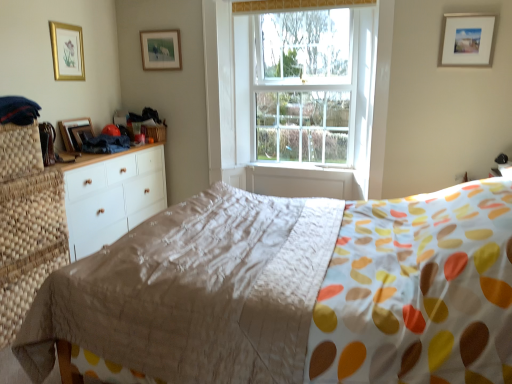
Measure the distance between white wood chest of drawers at left and camera.

8.90 feet.

What is the approximate height of white matte picture frame at upper right, placed as the fourth picture frame when sorted from left to right?

It is 14.69 inches.

At what (x,y) coordinates should I click in order to perform the action: click on matte beige quilt at center. Please return your answer as a coordinate pair (x, y). The height and width of the screenshot is (384, 512). Looking at the image, I should click on (302, 292).

Locate an element on the screen. The width and height of the screenshot is (512, 384). gold-framed picture at upper left, the fourth picture frame when ordered from right to left is located at coordinates (67, 51).

The width and height of the screenshot is (512, 384). I want to click on white painted wood at center, so click(296, 168).

The image size is (512, 384). I want to click on wooden picture frame at left, which is counted as the 3th picture frame, starting from the right, so click(x=75, y=133).

I want to click on white wood chest of drawers at left, so click(x=113, y=198).

Is white wood chest of drawers at left far from white painted wood at center?

white wood chest of drawers at left is far away from white painted wood at center.

Does point (87, 206) come farther from viewer compared to point (297, 173)?

No.

Does white wood chest of drawers at left have a larger size compared to white painted wood at center?

Indeed, white wood chest of drawers at left has a larger size compared to white painted wood at center.

Is there a large distance between clear glass window at center and matte beige quilt at center?

Yes, clear glass window at center and matte beige quilt at center are quite far apart.

From the picture: Does clear glass window at center appear on the right side of matte beige quilt at center?

Correct, you'll find clear glass window at center to the right of matte beige quilt at center.

Considering the sizes of clear glass window at center and matte beige quilt at center in the image, is clear glass window at center wider or thinner than matte beige quilt at center?

Considering their sizes, clear glass window at center looks slimmer than matte beige quilt at center.

Could you tell me if matte gold picture frame at upper center, positioned as the second picture frame in right-to-left order, is turned towards clear glass window at center?

No, matte gold picture frame at upper center, positioned as the second picture frame in right-to-left order, is not turned towards clear glass window at center.

Which object is thinner, matte gold picture frame at upper center, the third picture frame when ordered from left to right, or clear glass window at center?

With smaller width is matte gold picture frame at upper center, the third picture frame when ordered from left to right.

From a real-world perspective, is matte gold picture frame at upper center, positioned as the second picture frame in right-to-left order, physically located above or below clear glass window at center?

In terms of real-world spatial position, matte gold picture frame at upper center, positioned as the second picture frame in right-to-left order, is above clear glass window at center.

From a real-world perspective, is white wood chest of drawers at left positioned over clear glass window at center based on gravity?

Actually, white wood chest of drawers at left is physically below clear glass window at center in the real world.

Is white wood chest of drawers at left taller or shorter than clear glass window at center?

Clearly, white wood chest of drawers at left is shorter compared to clear glass window at center.

Which is correct: white wood chest of drawers at left is inside clear glass window at center, or outside of it?

white wood chest of drawers at left is located beyond the bounds of clear glass window at center.

Is white wood chest of drawers at left positioned far away from clear glass window at center?

white wood chest of drawers at left is far away from clear glass window at center.

Could you tell me if white matte picture frame at upper right, placed as the fourth picture frame when sorted from left to right, is turned towards gold-framed picture at upper left, the fourth picture frame when ordered from right to left?

No, white matte picture frame at upper right, placed as the fourth picture frame when sorted from left to right, does not turn towards gold-framed picture at upper left, the fourth picture frame when ordered from right to left.

Which is nearer, (462, 47) or (49, 27)?

Clearly, point (462, 47) is closer to the camera than point (49, 27).

From the picture: Between white matte picture frame at upper right, the first picture frame positioned from the right, and gold-framed picture at upper left, arranged as the first picture frame when viewed from the left, which one has larger size?

white matte picture frame at upper right, the first picture frame positioned from the right.

How many degrees apart are the facing directions of white matte picture frame at upper right, placed as the fourth picture frame when sorted from left to right, and gold-framed picture at upper left, arranged as the first picture frame when viewed from the left?

The facing directions of white matte picture frame at upper right, placed as the fourth picture frame when sorted from left to right, and gold-framed picture at upper left, arranged as the first picture frame when viewed from the left, are 90.7 degrees apart.

Which is closer, (63, 121) or (130, 165)?

Point (63, 121).

Does wooden picture frame at left, which is counted as the 3th picture frame, starting from the right, have a greater height compared to white wood chest of drawers at left?

No, wooden picture frame at left, which is counted as the 3th picture frame, starting from the right, is not taller than white wood chest of drawers at left.

Is wooden picture frame at left, the 2th picture frame from the left, next to white wood chest of drawers at left and touching it?

No, wooden picture frame at left, the 2th picture frame from the left, is not touching white wood chest of drawers at left.

The width and height of the screenshot is (512, 384). In order to click on the chest of drawers that appears below the wooden picture frame at left, the 2th picture frame from the left (from a real-world perspective) in this screenshot , I will do `click(113, 198)`.

Is matte beige quilt at center not within white wood chest of drawers at left?

That's correct, matte beige quilt at center is outside of white wood chest of drawers at left.

Which object is closer to the camera taking this photo, matte beige quilt at center or white wood chest of drawers at left?

matte beige quilt at center is in front.

The image size is (512, 384). I want to click on chest of drawers behind the matte beige quilt at center, so click(113, 198).

Is matte beige quilt at center bigger than white wood chest of drawers at left?

Yes, matte beige quilt at center is bigger than white wood chest of drawers at left.

In the image, there is a white painted wood at center. At what (x,y) coordinates should I click in order to perform the action: click on the chest of drawers below it (from the image's perspective). Please return your answer as a coordinate pair (x, y). Image resolution: width=512 pixels, height=384 pixels. Looking at the image, I should click on (113, 198).

The height and width of the screenshot is (384, 512). Identify the location of window on the right of matte beige quilt at center. (296, 90).

Which object lies nearer to the anchor point clear glass window at center, gold-framed picture at upper left, the fourth picture frame when ordered from right to left, or white wood chest of drawers at left?

The object closer to clear glass window at center is white wood chest of drawers at left.

From the image, which object appears to be nearer to wooden picture frame at left, the 2th picture frame from the left, white matte picture frame at upper right, placed as the fourth picture frame when sorted from left to right, or white painted wood at center?

Among the two, white painted wood at center is located nearer to wooden picture frame at left, the 2th picture frame from the left.

Considering their positions, is white wood chest of drawers at left positioned further to white matte picture frame at upper right, placed as the fourth picture frame when sorted from left to right, than white painted wood at center?

The object further to white matte picture frame at upper right, placed as the fourth picture frame when sorted from left to right, is white wood chest of drawers at left.

Estimate the real-world distances between objects in this image. Which object is closer to wooden picture frame at left, the 2th picture frame from the left, matte beige quilt at center or gold-framed picture at upper left, the fourth picture frame when ordered from right to left?

Based on the image, gold-framed picture at upper left, the fourth picture frame when ordered from right to left, appears to be nearer to wooden picture frame at left, the 2th picture frame from the left.

Considering their positions, is white painted wood at center positioned further to gold-framed picture at upper left, arranged as the first picture frame when viewed from the left, than wooden picture frame at left, which is counted as the 3th picture frame, starting from the right?

white painted wood at center lies further to gold-framed picture at upper left, arranged as the first picture frame when viewed from the left, than the other object.

In the scene shown: When comparing their distances from matte gold picture frame at upper center, positioned as the second picture frame in right-to-left order, does gold-framed picture at upper left, the fourth picture frame when ordered from right to left, or clear glass window at center seem further?

Based on the image, clear glass window at center appears to be further to matte gold picture frame at upper center, positioned as the second picture frame in right-to-left order.

Which object lies nearer to the anchor point matte beige quilt at center, white matte picture frame at upper right, the first picture frame positioned from the right, or wooden picture frame at left, which is counted as the 3th picture frame, starting from the right?

Among the two, white matte picture frame at upper right, the first picture frame positioned from the right, is located nearer to matte beige quilt at center.

Which object lies nearer to the anchor point white matte picture frame at upper right, the first picture frame positioned from the right, matte gold picture frame at upper center, the third picture frame when ordered from left to right, or wooden picture frame at left, which is counted as the 3th picture frame, starting from the right?

matte gold picture frame at upper center, the third picture frame when ordered from left to right.

I want to click on chest of drawers between matte beige quilt at center and wooden picture frame at left, the 2th picture frame from the left, from front to back, so click(113, 198).

Locate an element on the screen. The height and width of the screenshot is (384, 512). window sill located between matte gold picture frame at upper center, the third picture frame when ordered from left to right, and white matte picture frame at upper right, placed as the fourth picture frame when sorted from left to right, in the left-right direction is located at coordinates (296, 168).

The width and height of the screenshot is (512, 384). Find the location of `window sill situated between white wood chest of drawers at left and clear glass window at center from left to right`. window sill situated between white wood chest of drawers at left and clear glass window at center from left to right is located at coordinates (296, 168).

This screenshot has height=384, width=512. Find the location of `bed between white wood chest of drawers at left and white matte picture frame at upper right, placed as the fourth picture frame when sorted from left to right, from left to right`. bed between white wood chest of drawers at left and white matte picture frame at upper right, placed as the fourth picture frame when sorted from left to right, from left to right is located at coordinates (302, 292).